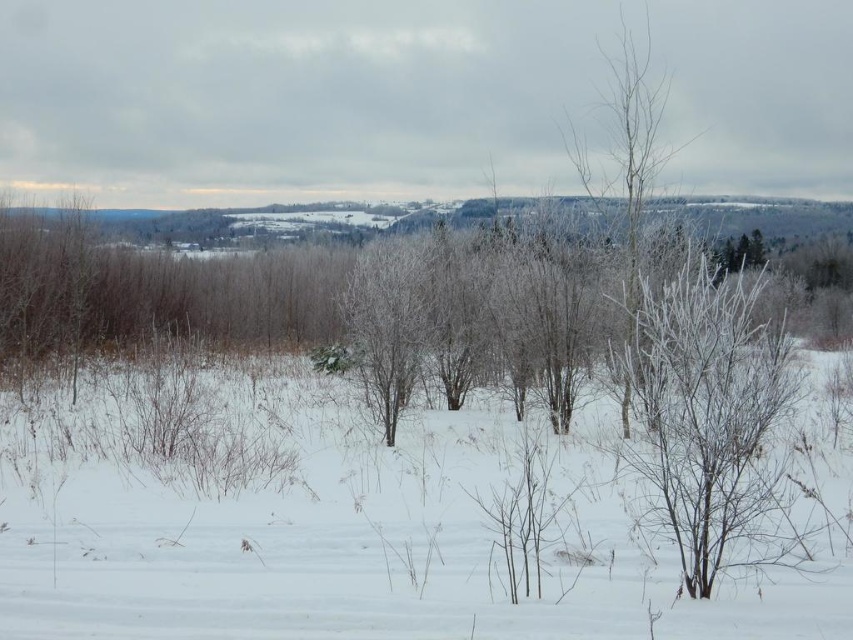
You are an observer standing in the winter landscape. You notice the white fluffy snow at center and the frosted branches at right. Which object is closer to the ground?

The white fluffy snow at center is closer to the ground because it is shorter than the frosted branches at right.

You are an observer standing in the winter landscape. You notice the white fluffy snow at center and the frosted branches at right. Which object is located above the other?

The frosted branches at right are above the white fluffy snow at center because the snow is positioned under the branches.

You are an observer standing at the edge of the winter landscape. You notice the white fluffy snow at center and the frosted branches at right. Which of these two objects occupies a larger horizontal space in the image?

The white fluffy snow at center is wider than the frosted branches at right, so it occupies a larger horizontal space in the image.